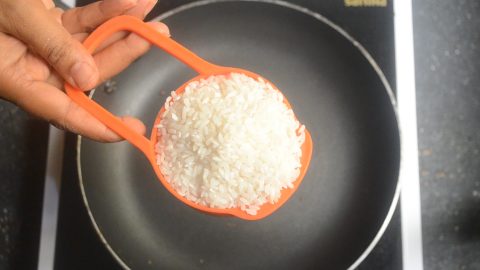
The height and width of the screenshot is (270, 480). I want to click on frying pan, so click(343, 196).